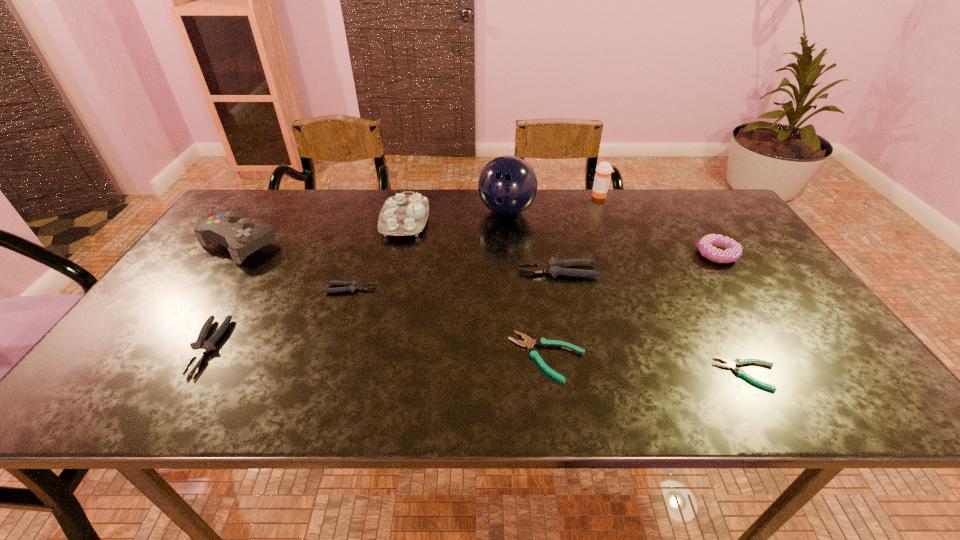
Where is `blue bowling ball`? This screenshot has height=540, width=960. blue bowling ball is located at coordinates (507, 185).

The width and height of the screenshot is (960, 540). Find the location of `bowling ball`. bowling ball is located at coordinates (507, 185).

You are a GUI agent. You are given a task and a screenshot of the screen. Output one action in this format:
    pyautogui.click(x=<x>, y=<y>)
    Task: Click on the medicine
    Image resolution: width=960 pixels, height=540 pixels.
    Given the screenshot: What is the action you would take?
    pyautogui.click(x=603, y=171)

This screenshot has width=960, height=540. Identify the location of orange medicine. click(x=603, y=171).

Identify the location of chinaware. This screenshot has height=540, width=960. (401, 215).

Where is `control`? Image resolution: width=960 pixels, height=540 pixels. control is located at coordinates (232, 229).

Find the location of a particular element. The image size is (960, 540). doughnut is located at coordinates (730, 250).

Where is `the sixth shortest object`? The width and height of the screenshot is (960, 540). the sixth shortest object is located at coordinates (730, 250).

You are a GUI agent. You are given a task and a screenshot of the screen. Output one action in this format:
    pyautogui.click(x=<x>, y=<y>)
    Task: Click on the farthest gray pliers
    
    Given the screenshot: What is the action you would take?
    pyautogui.click(x=554, y=267)

This screenshot has height=540, width=960. Identify the location of the tallest pliers. (554, 267).